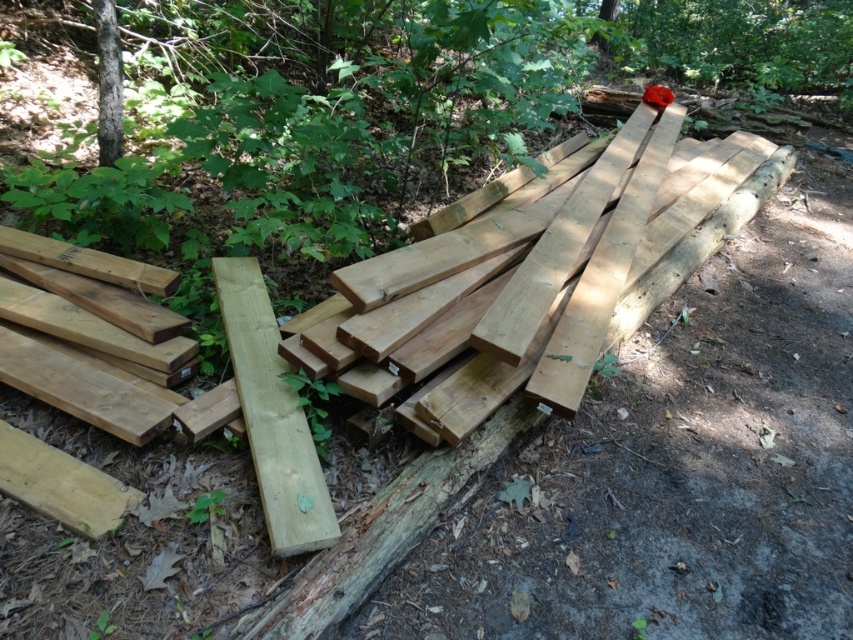
Question: Which object is farther from the camera taking this photo?

Choices:
 (A) natural light wood plank at center
 (B) smooth brown tree trunk at upper left

Answer: (B)

Question: Can you confirm if natural light wood plank at center is wider than smooth brown tree trunk at upper left?

Choices:
 (A) yes
 (B) no

Answer: (A)

Question: Is natural light wood plank at center positioned before smooth brown tree trunk at upper left?

Choices:
 (A) no
 (B) yes

Answer: (B)

Question: Is natural light wood plank at center to the left of smooth brown tree trunk at upper left from the viewer's perspective?

Choices:
 (A) yes
 (B) no

Answer: (B)